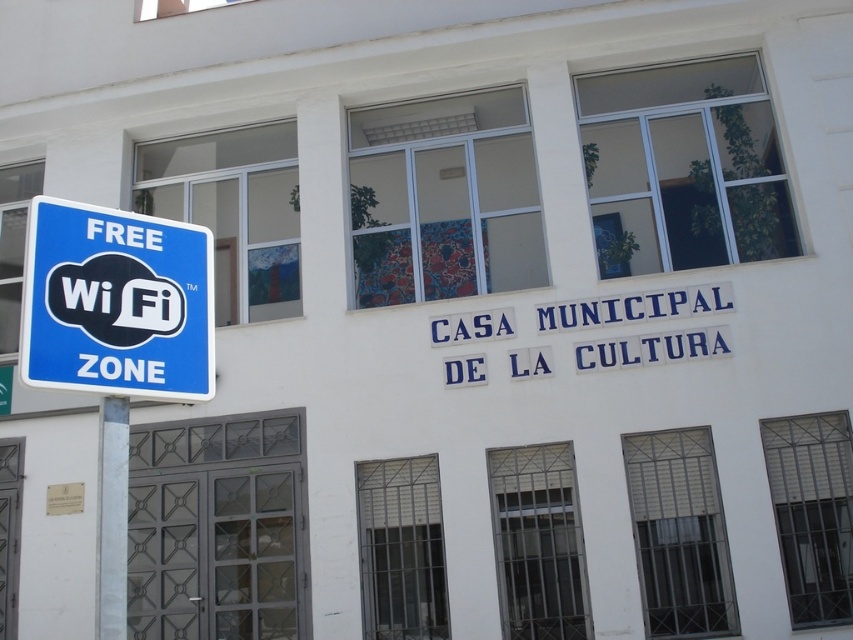
Question: Which point appears closest to the camera in this image?

Choices:
 (A) (103, 637)
 (B) (126, 253)

Answer: (A)

Question: Considering the relative positions of blue plastic sign at left and white marble pole at left in the image provided, where is blue plastic sign at left located with respect to white marble pole at left?

Choices:
 (A) right
 (B) left

Answer: (B)

Question: Among these objects, which one is farthest from the camera?

Choices:
 (A) blue plastic sign at left
 (B) white marble pole at left

Answer: (A)

Question: Considering the relative positions of blue plastic sign at left and white marble pole at left in the image provided, where is blue plastic sign at left located with respect to white marble pole at left?

Choices:
 (A) below
 (B) above

Answer: (B)

Question: Considering the relative positions of blue plastic sign at left and white marble pole at left in the image provided, where is blue plastic sign at left located with respect to white marble pole at left?

Choices:
 (A) above
 (B) below

Answer: (A)